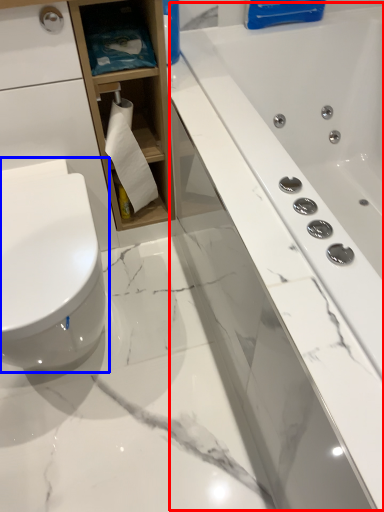
Question: Among these objects, which one is farthest to the camera, bath (highlighted by a red box) or toilet (highlighted by a blue box)?

Choices:
 (A) bath
 (B) toilet

Answer: (B)